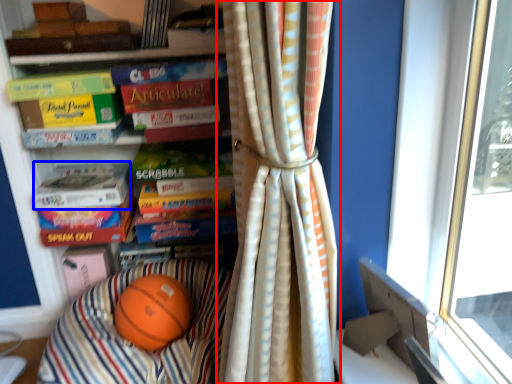
Question: Which of the following is the closest to the observer, curtain (highlighted by a red box) or paperback book (highlighted by a blue box)?

Choices:
 (A) curtain
 (B) paperback book

Answer: (A)